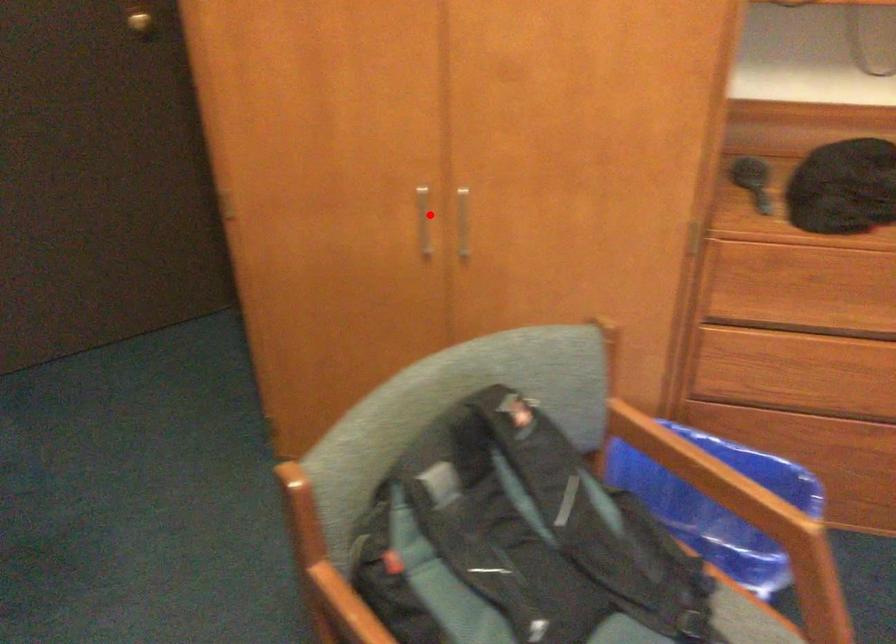
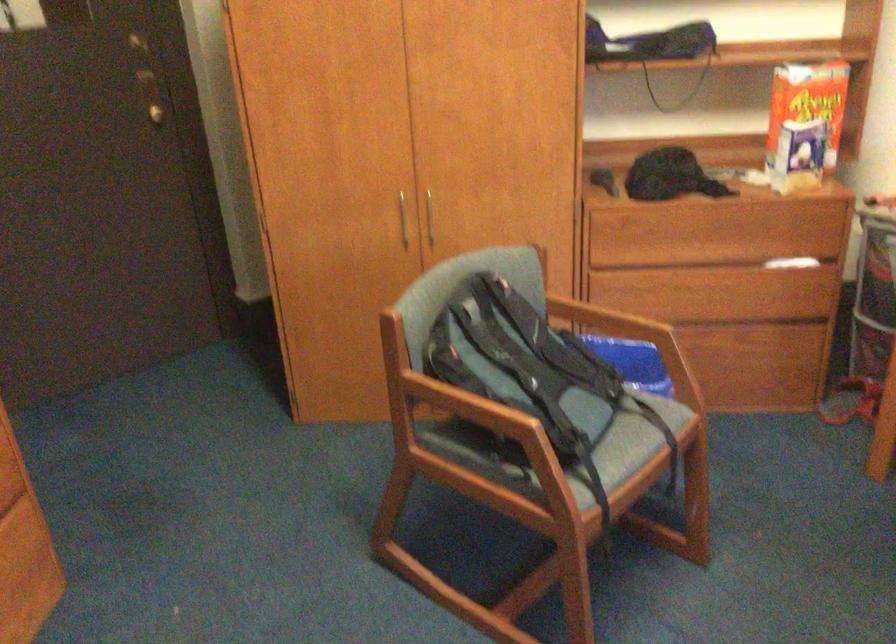
Question: I am providing you with two images of the same scene from different viewpoints. Image1 has a red point marked. In image2, the corresponding 3D location appears at what relative position? Reply with the corresponding letter.

Choices:
 (A) Closer
 (B) Farther

Answer: (B)